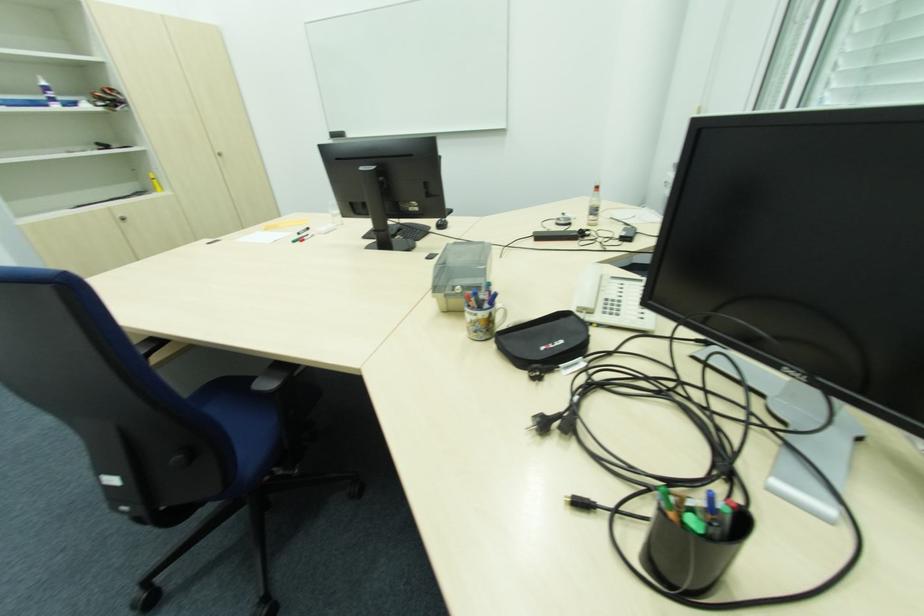
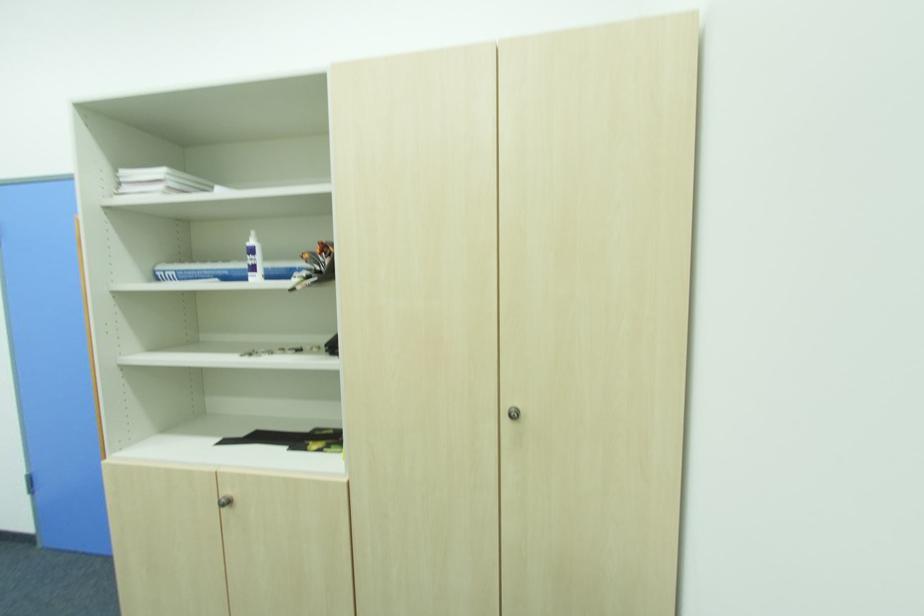
The point at (128,220) is marked in the first image. Where is the corresponding point in the second image?

(229, 504)